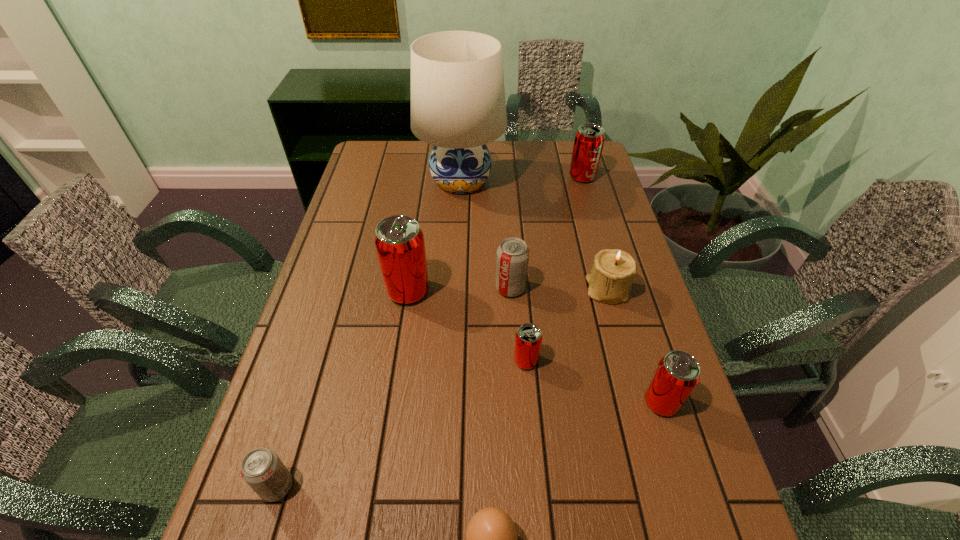
In the image, there is a desktop. Where is `free space at the right edge`? free space at the right edge is located at coordinates (581, 238).

At what (x,y) coordinates should I click in order to perform the action: click on vacant area at the far left corner of the desktop. Please return your answer as a coordinate pair (x, y). The image size is (960, 540). Looking at the image, I should click on (390, 164).

The height and width of the screenshot is (540, 960). I want to click on free region at the far right corner of the desktop, so click(x=564, y=169).

Identify the location of free point between the farther gray soda can and the nearest soda can. (394, 387).

Locate an element on the screen. This screenshot has height=540, width=960. empty location between the eighth farthest object and the fifth farthest soda can is located at coordinates (469, 444).

Locate an element on the screen. The height and width of the screenshot is (540, 960). vacant area that lies between the tallest soda can and the nearest soda can is located at coordinates (343, 389).

The width and height of the screenshot is (960, 540). In order to click on free area in between the right gray soda can and the third nearest object in this screenshot , I will do (586, 345).

The width and height of the screenshot is (960, 540). Find the location of `vacant area that lies between the candle_holder and the seventh farthest object`. vacant area that lies between the candle_holder and the seventh farthest object is located at coordinates (635, 346).

Find the location of a particular element. The height and width of the screenshot is (540, 960). object that ranks as the third closest to the farthest soda can is located at coordinates (512, 260).

Find the location of `object identified as the second closest to the eighth shortest object`. object identified as the second closest to the eighth shortest object is located at coordinates coord(528,340).